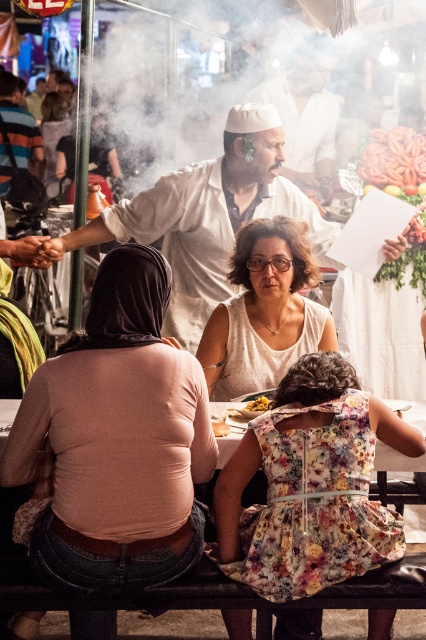
Is pale pink fabric at center above smooth yellow bread at lower center?

Yes, pale pink fabric at center is above smooth yellow bread at lower center.

Which is behind, point (164, 570) or point (221, 429)?

The point (221, 429) is behind.

This screenshot has width=426, height=640. What do you see at coordinates (118, 440) in the screenshot?
I see `pale pink fabric at center` at bounding box center [118, 440].

Locate an element on the screen. The image size is (426, 640). pale pink fabric at center is located at coordinates (118, 440).

Which is behind, point (305, 323) or point (391, 179)?

Point (391, 179)

Where is `matte white blouse at center`? matte white blouse at center is located at coordinates (264, 310).

Can you confirm if floral dress at lower center is positioned to the right of smooth yellow bread at lower center?

Correct, you'll find floral dress at lower center to the right of smooth yellow bread at lower center.

Does floral dress at lower center appear over smooth yellow bread at lower center?

No, floral dress at lower center is not above smooth yellow bread at lower center.

Who is more forward, [325,582] or [226,433]?

Point [325,582] is more forward.

This screenshot has height=640, width=426. What are the coordinates of `floral dress at lower center` in the screenshot? It's located at (311, 483).